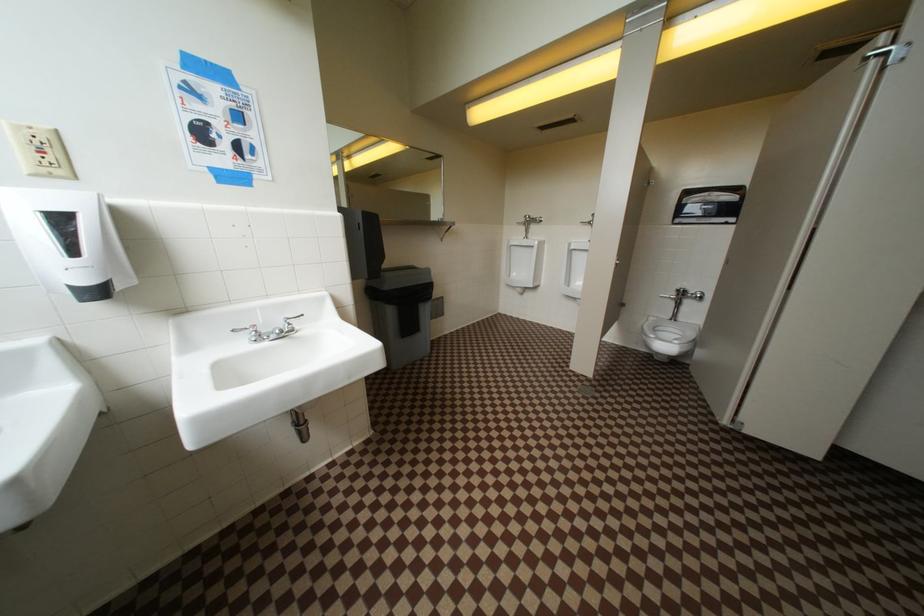
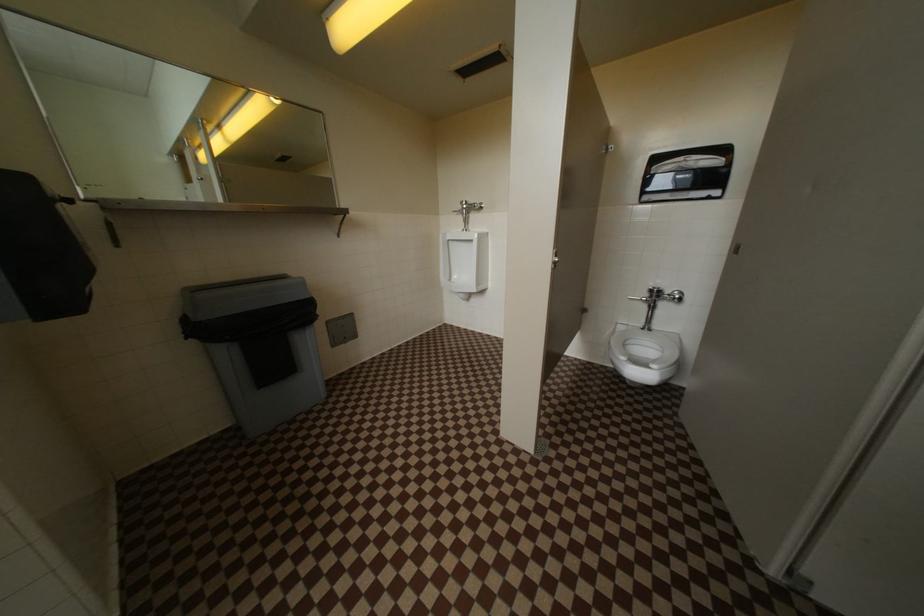
Question: Based on the continuous images, in which direction is the camera rotating? Reply with the corresponding letter.

Choices:
 (A) Left
 (B) Right
 (C) Up
 (D) Down

Answer: (B)